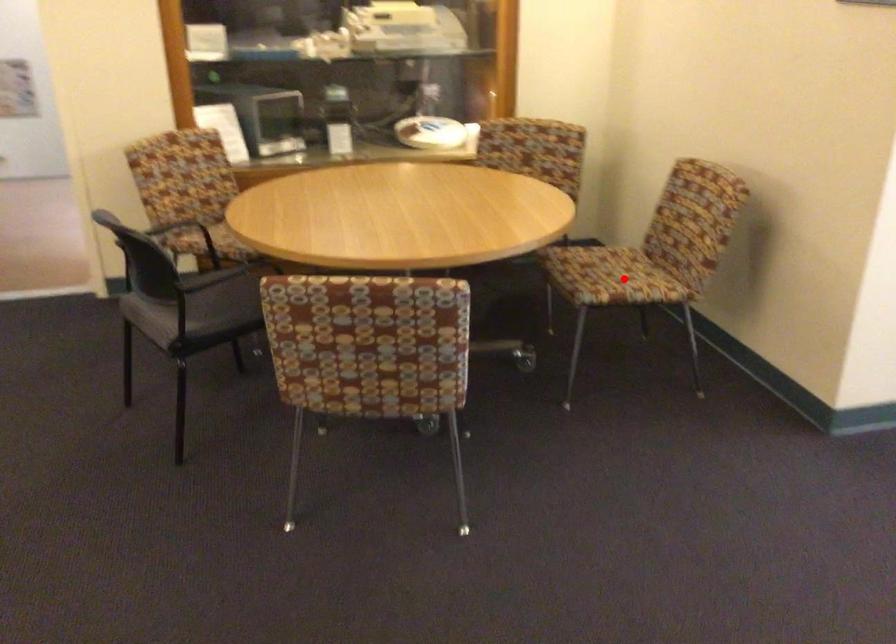
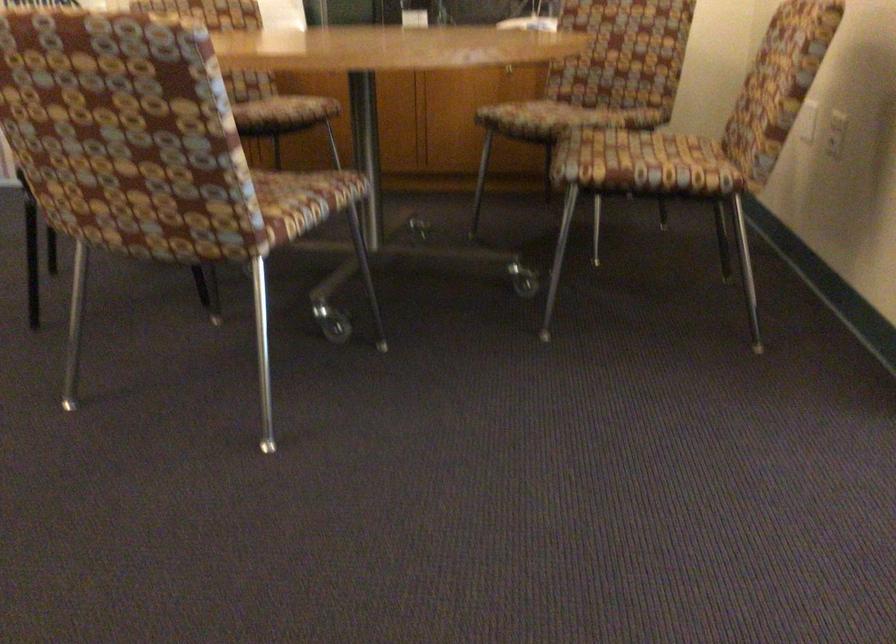
The point at the highlighted location is marked in the first image. Where is the corresponding point in the second image?

(643, 164)